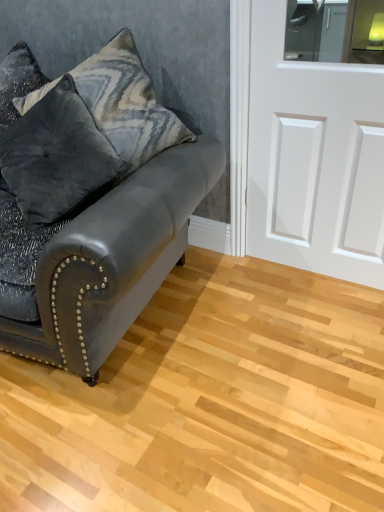
Question: Is velvet gray pillow at upper left, which is the first pillow in top-to-bottom order, wider than matte black leather couch at left?

Choices:
 (A) no
 (B) yes

Answer: (A)

Question: Considering the relative sizes of velvet gray pillow at upper left, the second pillow positioned from the bottom, and matte black leather couch at left in the image provided, is velvet gray pillow at upper left, the second pillow positioned from the bottom, shorter than matte black leather couch at left?

Choices:
 (A) yes
 (B) no

Answer: (A)

Question: Does velvet gray pillow at upper left, the second pillow positioned from the bottom, have a greater height compared to matte black leather couch at left?

Choices:
 (A) no
 (B) yes

Answer: (A)

Question: From the image's perspective, is velvet gray pillow at upper left, which is the first pillow in top-to-bottom order, on top of matte black leather couch at left?

Choices:
 (A) yes
 (B) no

Answer: (A)

Question: Is the position of velvet gray pillow at upper left, which is the first pillow in top-to-bottom order, more distant than that of matte black leather couch at left?

Choices:
 (A) yes
 (B) no

Answer: (A)

Question: Is velvet gray pillow at upper left, the second pillow positioned from the bottom, bigger or smaller than matte black leather couch at left?

Choices:
 (A) big
 (B) small

Answer: (B)

Question: From a real-world perspective, relative to matte black leather couch at left, is velvet gray pillow at upper left, which is the first pillow in top-to-bottom order, vertically above or below?

Choices:
 (A) below
 (B) above

Answer: (B)

Question: Is velvet gray pillow at upper left, the second pillow positioned from the bottom, to the left or to the right of matte black leather couch at left in the image?

Choices:
 (A) left
 (B) right

Answer: (B)

Question: Which is correct: velvet gray pillow at upper left, which is the first pillow in top-to-bottom order, is inside matte black leather couch at left, or outside of it?

Choices:
 (A) inside
 (B) outside

Answer: (A)

Question: Relative to velvet gray pillow at upper left, the second pillow positioned from the bottom, is white matte door at right in front or behind?

Choices:
 (A) front
 (B) behind

Answer: (A)

Question: Considering the positions of white matte door at right and velvet gray pillow at upper left, the second pillow positioned from the bottom, in the image, is white matte door at right taller or shorter than velvet gray pillow at upper left, the second pillow positioned from the bottom,?

Choices:
 (A) tall
 (B) short

Answer: (A)

Question: In terms of size, does white matte door at right appear bigger or smaller than velvet gray pillow at upper left, which is the first pillow in top-to-bottom order?

Choices:
 (A) small
 (B) big

Answer: (A)

Question: Considering the positions of point (297, 229) and point (115, 131), is point (297, 229) closer or farther from the camera than point (115, 131)?

Choices:
 (A) farther
 (B) closer

Answer: (A)

Question: Considering their positions, is velvet gray pillow at upper left, which is the first pillow in top-to-bottom order, located in front of or behind velvet dark gray pillow at left, which is counted as the 2th pillow, starting from the top?

Choices:
 (A) front
 (B) behind

Answer: (B)

Question: Is point (110, 117) closer or farther from the camera than point (21, 143)?

Choices:
 (A) farther
 (B) closer

Answer: (A)